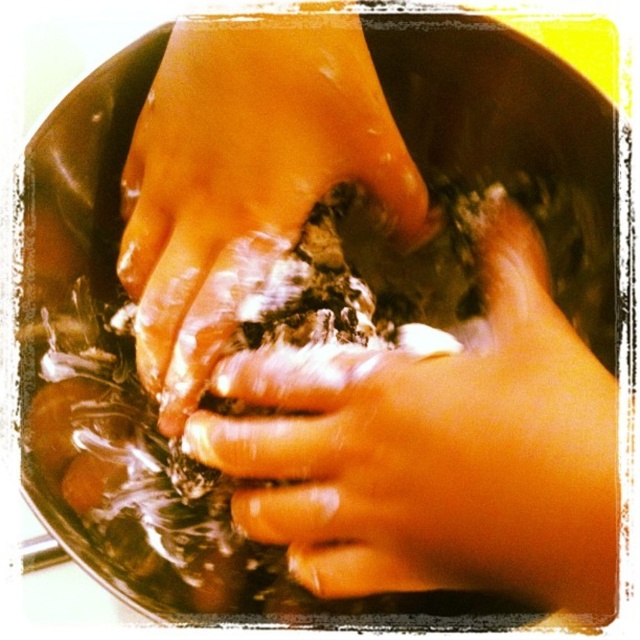
Question: Is smooth skin hands at center bigger than dry skin at center?

Choices:
 (A) no
 (B) yes

Answer: (B)

Question: Which object appears farthest from the camera in this image?

Choices:
 (A) dry skin at center
 (B) smooth skin hands at center

Answer: (A)

Question: Is smooth skin hands at center to the right of dry skin at center from the viewer's perspective?

Choices:
 (A) no
 (B) yes

Answer: (B)

Question: Can you confirm if smooth skin hands at center is smaller than dry skin at center?

Choices:
 (A) yes
 (B) no

Answer: (B)

Question: Which point is closer to the camera taking this photo?

Choices:
 (A) [x=193, y=352]
 (B) [x=522, y=237]

Answer: (A)

Question: Which point appears closest to the camera in this image?

Choices:
 (A) (492, 321)
 (B) (291, 81)

Answer: (B)